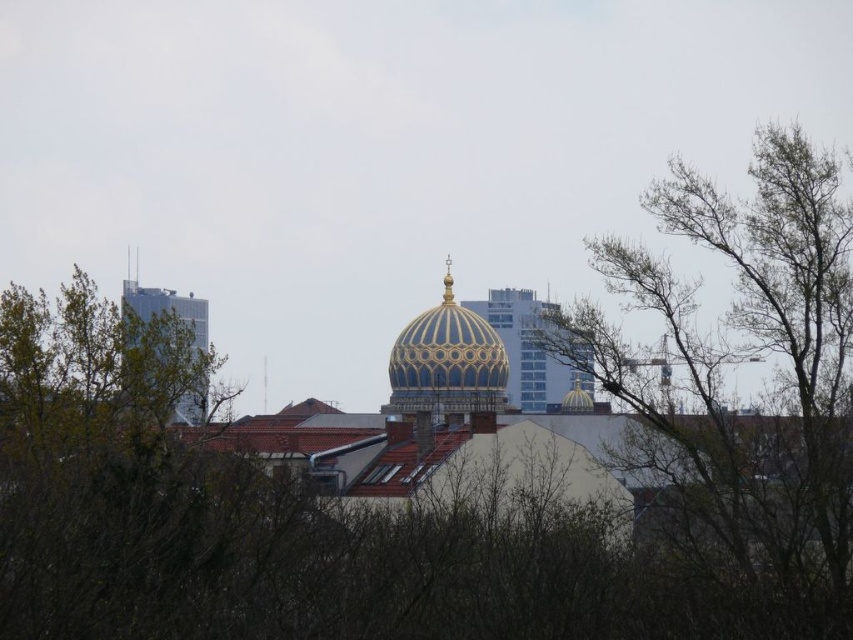
Does bare branches at upper right have a greater width compared to gold metallic dome at center?

Correct, the width of bare branches at upper right exceeds that of gold metallic dome at center.

Which is more to the right, bare branches at upper right or gold metallic dome at center?

bare branches at upper right

Is point (671, 532) less distant than point (395, 339)?

Yes, it is.

Identify the location of bare branches at upper right. click(728, 358).

Does bare branches at upper right have a greater height compared to glassy silver skyscraper at left?

Indeed, bare branches at upper right has a greater height compared to glassy silver skyscraper at left.

Find the location of a particular element. bare branches at upper right is located at coordinates (728, 358).

Does gold metallic dome at center have a smaller size compared to glassy silver skyscraper at left?

Yes, gold metallic dome at center is smaller than glassy silver skyscraper at left.

Is gold metallic dome at center further to the viewer compared to glassy silver skyscraper at left?

Yes, gold metallic dome at center is behind glassy silver skyscraper at left.

Measure the distance between gold metallic dome at center and camera.

A distance of 397.15 meters exists between gold metallic dome at center and camera.

Identify the location of gold metallic dome at center. (445, 362).